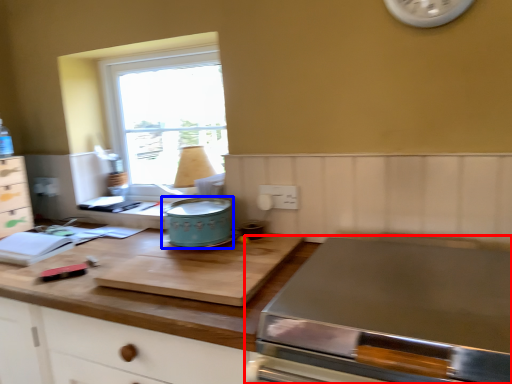
Question: Which of the following is the farthest to the observer, home appliance (highlighted by a red box) or appliance (highlighted by a blue box)?

Choices:
 (A) home appliance
 (B) appliance

Answer: (B)